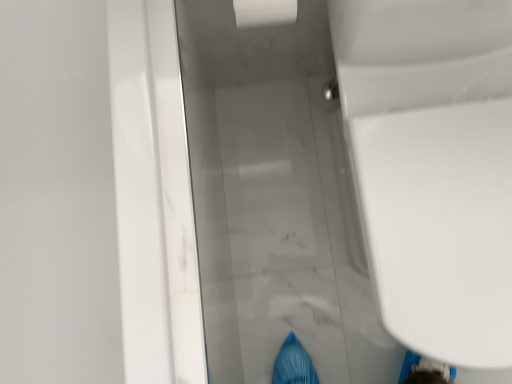
Measure the distance between white glossy toilet at right and camera.

white glossy toilet at right and camera are 56.38 centimeters apart from each other.

At what (x,y) coordinates should I click in order to perform the action: click on white glossy toilet at right. Please return your answer as a coordinate pair (x, y). Image resolution: width=512 pixels, height=384 pixels. Looking at the image, I should click on [433, 167].

Image resolution: width=512 pixels, height=384 pixels. What do you see at coordinates (433, 167) in the screenshot? I see `white glossy toilet at right` at bounding box center [433, 167].

Identify the location of white glossy toilet at right. This screenshot has height=384, width=512. (433, 167).